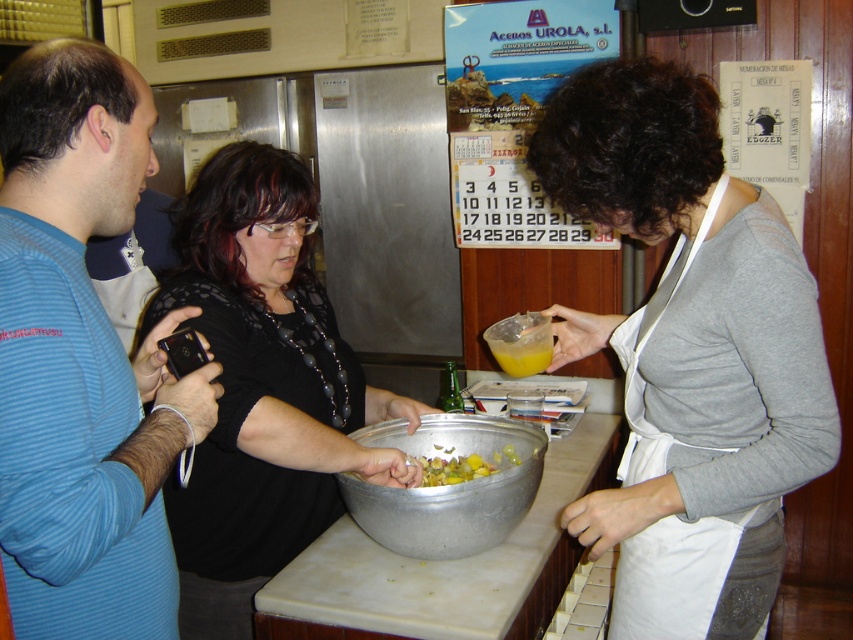
Question: Does black matte shirt at center come behind white fabric apron at center?

Choices:
 (A) no
 (B) yes

Answer: (A)

Question: Which point is farther to the camera?

Choices:
 (A) blue striped shirt at left
 (B) yellow matte bowl at center

Answer: (B)

Question: Which of the following is the farthest from the observer?

Choices:
 (A) pyautogui.click(x=514, y=346)
 (B) pyautogui.click(x=556, y=348)
 (C) pyautogui.click(x=624, y=598)

Answer: (A)

Question: Among these objects, which one is nearest to the camera?

Choices:
 (A) blue striped shirt at left
 (B) gray matte shirt at center
 (C) black matte shirt at center

Answer: (A)

Question: From the image, what is the correct spatial relationship of white fabric apron at center in relation to metallic bowl at center?

Choices:
 (A) right
 (B) left

Answer: (A)

Question: Is gray matte shirt at center above blue striped shirt at left?

Choices:
 (A) yes
 (B) no

Answer: (B)